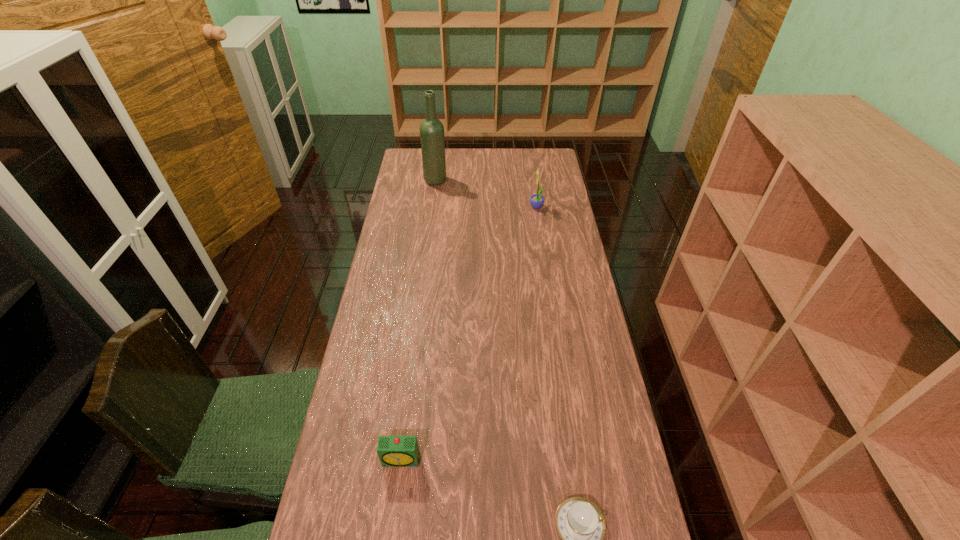
This screenshot has height=540, width=960. In order to click on free space located on the front-facing side of the alarm clock in this screenshot , I will do `click(395, 515)`.

This screenshot has height=540, width=960. In order to click on object present at the far edge in this screenshot , I will do `click(432, 139)`.

The height and width of the screenshot is (540, 960). Find the location of `wine bottle that is at the left edge`. wine bottle that is at the left edge is located at coordinates (432, 139).

Find the location of a particular element. alarm clock that is at the left edge is located at coordinates (393, 451).

Where is `object that is at the right edge`? object that is at the right edge is located at coordinates (536, 200).

At what (x,y) coordinates should I click in order to perform the action: click on object at the far left corner. Please return your answer as a coordinate pair (x, y). The image size is (960, 540). Looking at the image, I should click on (432, 139).

Find the location of a particular element. This screenshot has height=540, width=960. vacant area at the far edge of the desktop is located at coordinates point(474,153).

This screenshot has width=960, height=540. In the image, there is a desktop. What are the coordinates of `vacant space at the left edge` in the screenshot? It's located at (375, 461).

Find the location of a particular element. This screenshot has height=540, width=960. free space at the right edge is located at coordinates (578, 348).

Find the location of a particular element. This screenshot has height=540, width=960. vacant point at the far right corner is located at coordinates (531, 172).